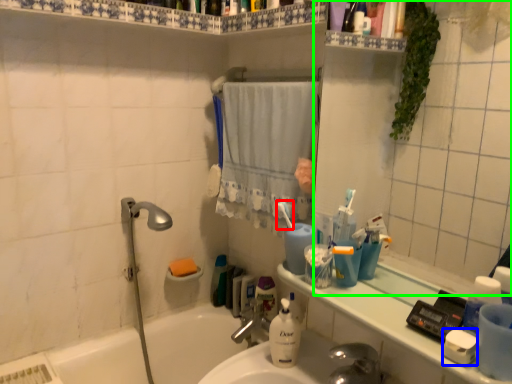
Question: Estimate the real-world distances between objects in this image. Which object is farther from toothbrush (highlighted by a red box), soap (highlighted by a blue box) or mirror (highlighted by a green box)?

Choices:
 (A) soap
 (B) mirror

Answer: (B)